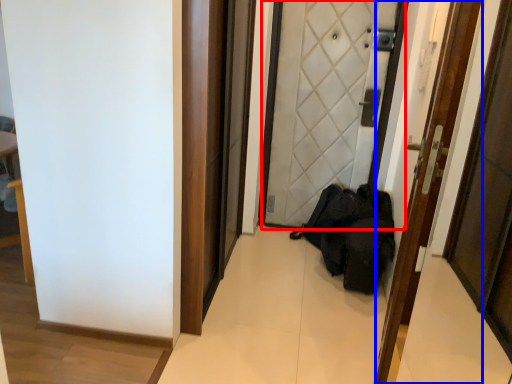
Question: Which object is further to the camera taking this photo, door (highlighted by a red box) or door (highlighted by a blue box)?

Choices:
 (A) door
 (B) door

Answer: (A)